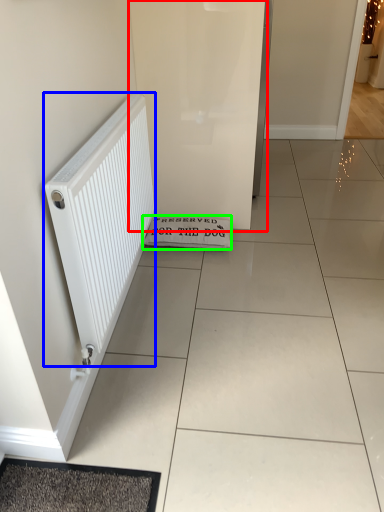
Question: Based on their relative distances, which object is nearer to screen door (highlighted by a red box)? Choose from radiator (highlighted by a blue box) and doormat (highlighted by a green box).

Choices:
 (A) radiator
 (B) doormat

Answer: (B)